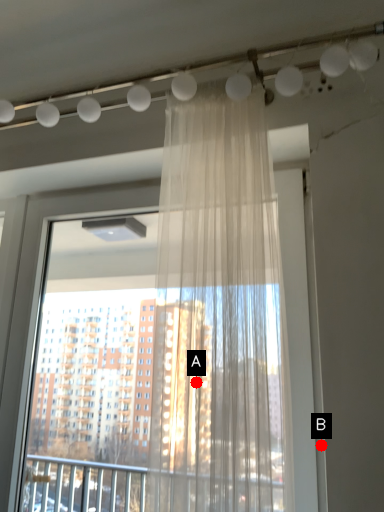
Question: Two points are circled on the image, labeled by A and B beside each circle. Which point appears farthest from the camera in this image?

Choices:
 (A) A is further
 (B) B is further

Answer: (B)